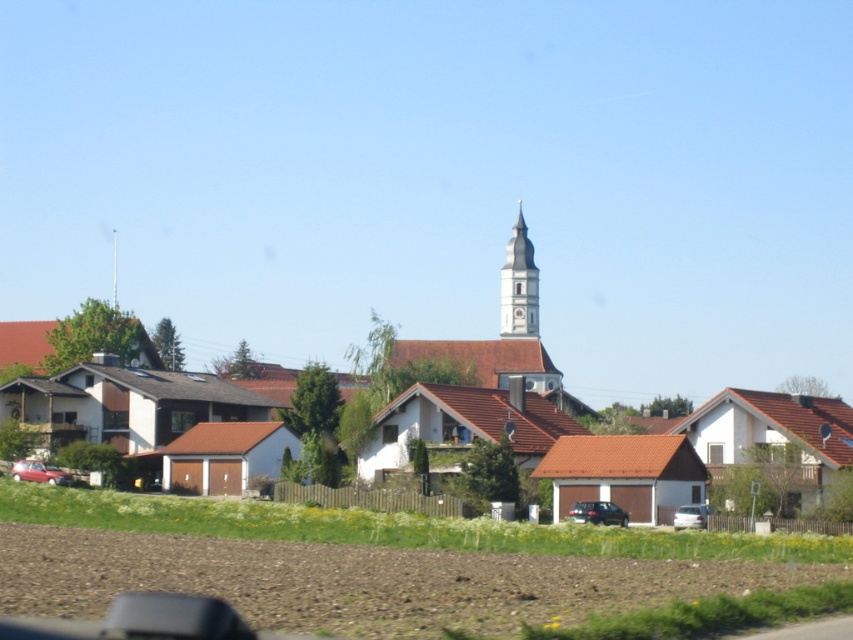
Based on the photo, you are a photographer standing in the middle of the plowed field. You want to take a picture of the white stone bell tower at center and the satin black suv at center. Which object should you adjust your camera angle upwards to capture?

You should adjust your camera angle upwards to capture the white stone bell tower at center because it is located above the satin black suv at center.

You are standing at the entrance of the village and want to take a photo of the satin black suv at center. Where should you position yourself to capture the vehicle in the frame?

To capture the satin black suv at center in the frame, position yourself at the entrance of the village facing towards the center of the scene, as the suv is located at coordinates point (596, 513) which is towards the lower right area of the image.